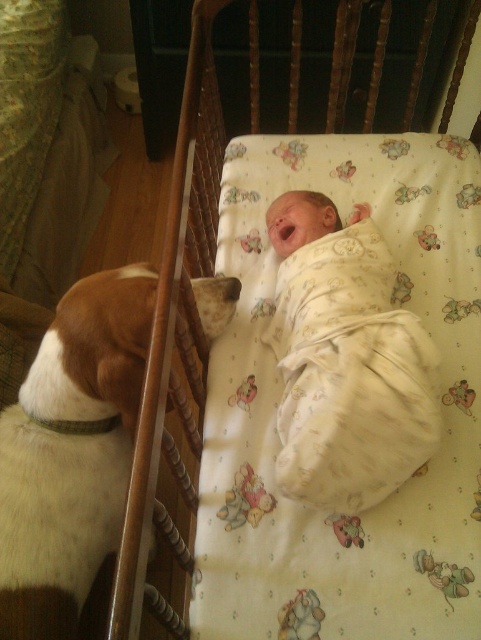
You are a parent checking on your baby. You see the white soft fabric at center and the brown and white fur at left in the crib area. Which item is covering the other?

The white soft fabric at center is positioned over brown and white fur at left, so the white soft fabric is covering the brown and white fur.

From the picture: You are a photographer trying to capture the perfect shot of the baby and the dog. The dog is at point [71,451]. To ensure both subjects are in frame, where should you position your camera relative to the crib?

The brown and white fur at left is located at point [71,451], so you should position the camera to the left side of the crib to include both the baby and the dog in the frame.